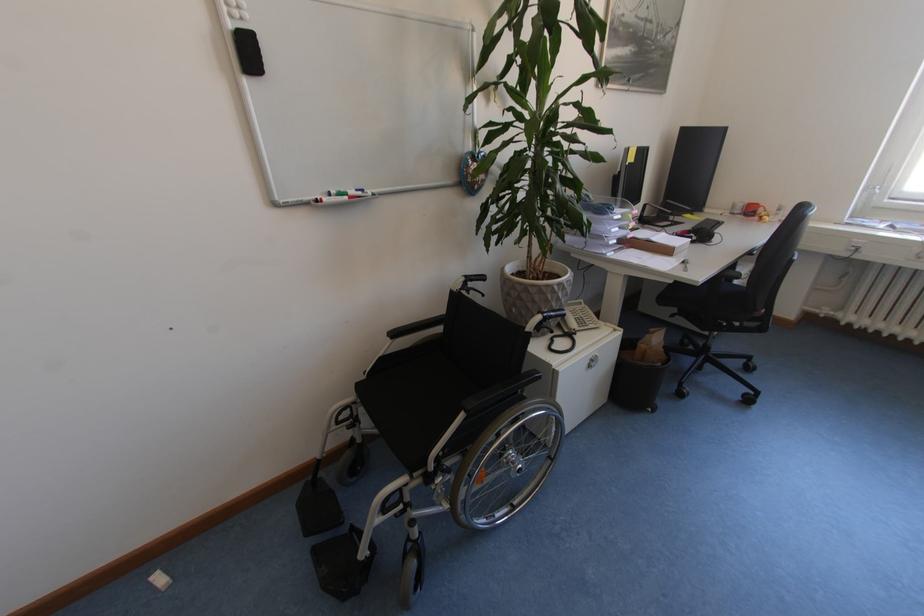
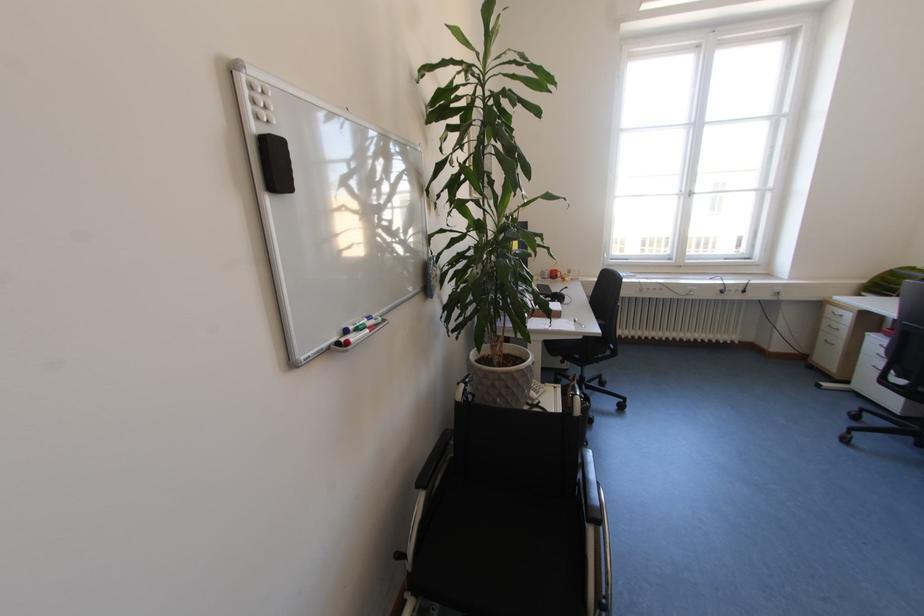
Find the pixel in the second image that matches (347,196) in the first image.

(366, 330)